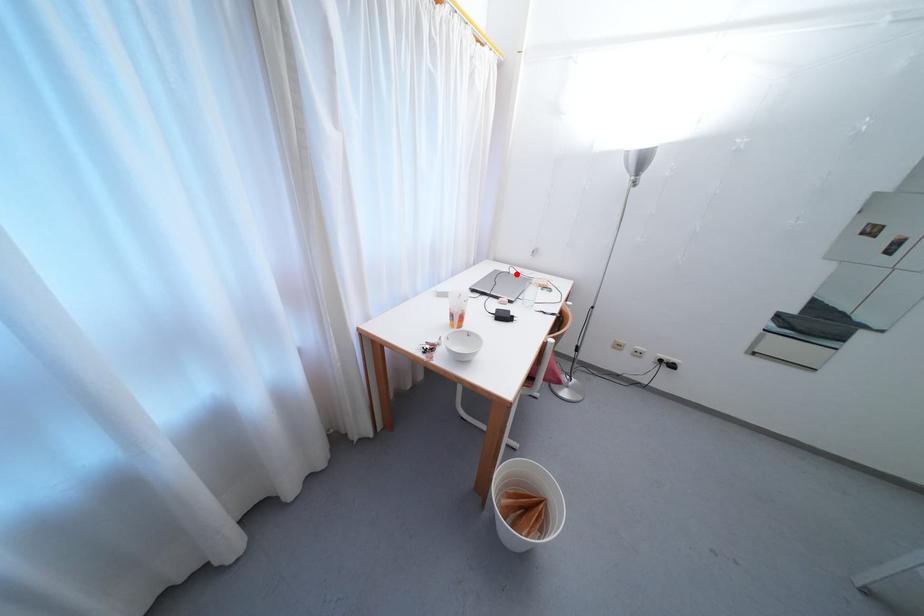
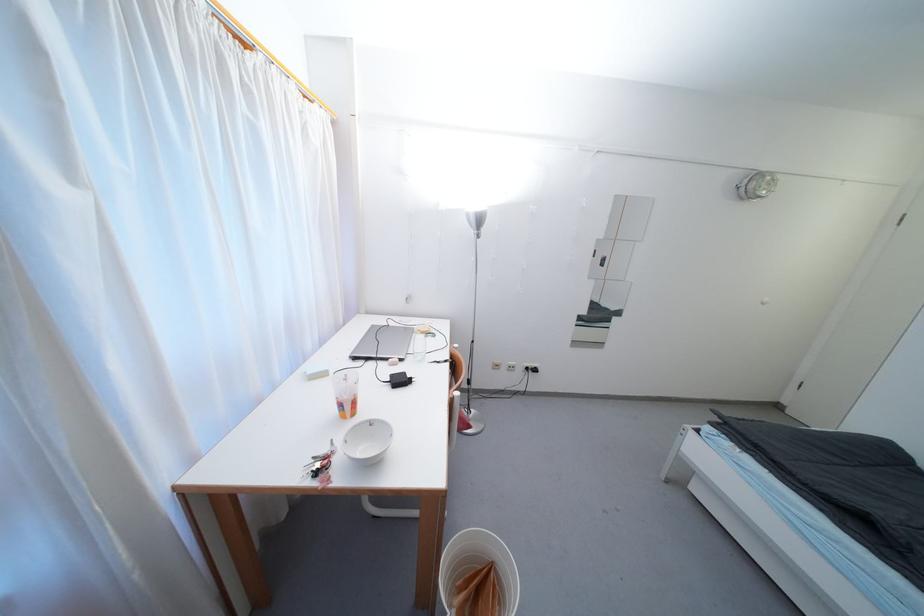
Find the pixel in the second image that matches the highlighted location in the first image.

(395, 326)